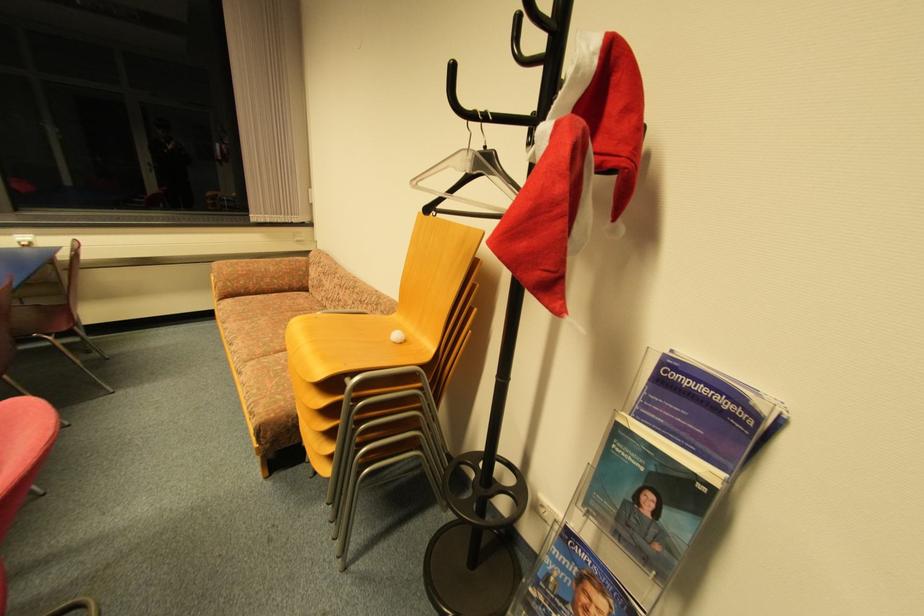
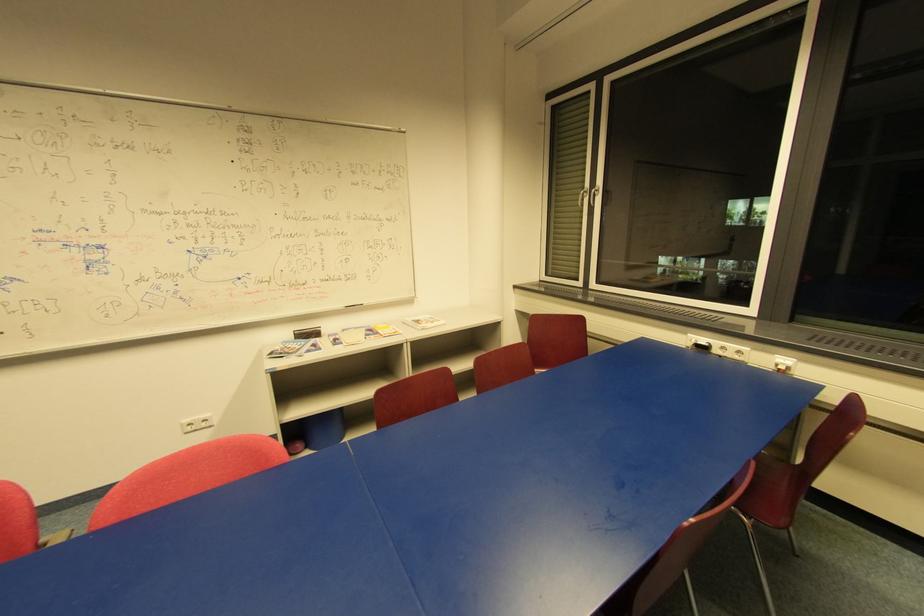
Find the pixel in the second image that matches (x=29, y=245) in the first image.

(785, 369)